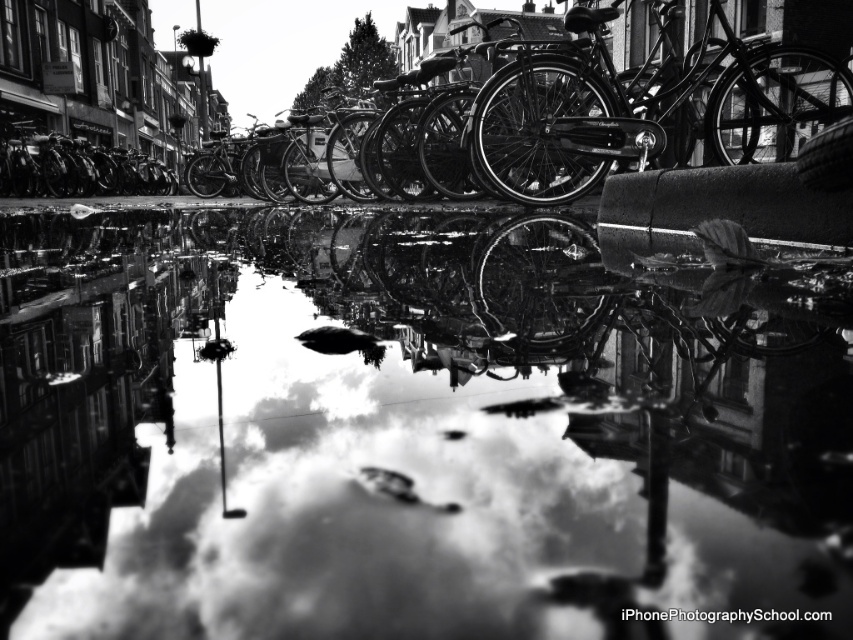
Can you confirm if reflective water at center is positioned to the left of shiny black bicycle at left?

In fact, reflective water at center is to the right of shiny black bicycle at left.

Is reflective water at center positioned behind shiny black bicycle at left?

No, reflective water at center is in front of shiny black bicycle at left.

You are a GUI agent. You are given a task and a screenshot of the screen. Output one action in this format:
    pyautogui.click(x=<x>, y=<y>)
    Task: Click on the reflective water at center
    The width and height of the screenshot is (853, 640).
    Given the screenshot: What is the action you would take?
    pyautogui.click(x=404, y=435)

I want to click on reflective water at center, so click(404, 435).

Who is positioned more to the left, polished metal bicycle at center or shiny black bicycle at left?

shiny black bicycle at left

Image resolution: width=853 pixels, height=640 pixels. What are the coordinates of `polished metal bicycle at center` in the screenshot? It's located at (641, 106).

At what (x,y) coordinates should I click in order to perform the action: click on polished metal bicycle at center. Please return your answer as a coordinate pair (x, y). The width and height of the screenshot is (853, 640). Looking at the image, I should click on (641, 106).

Who is more distant from viewer, (480,419) or (741,118)?

The point (741,118) is behind.

Where is `reflective water at center`? reflective water at center is located at coordinates (404, 435).

In order to click on reflective water at center in this screenshot , I will do `click(404, 435)`.